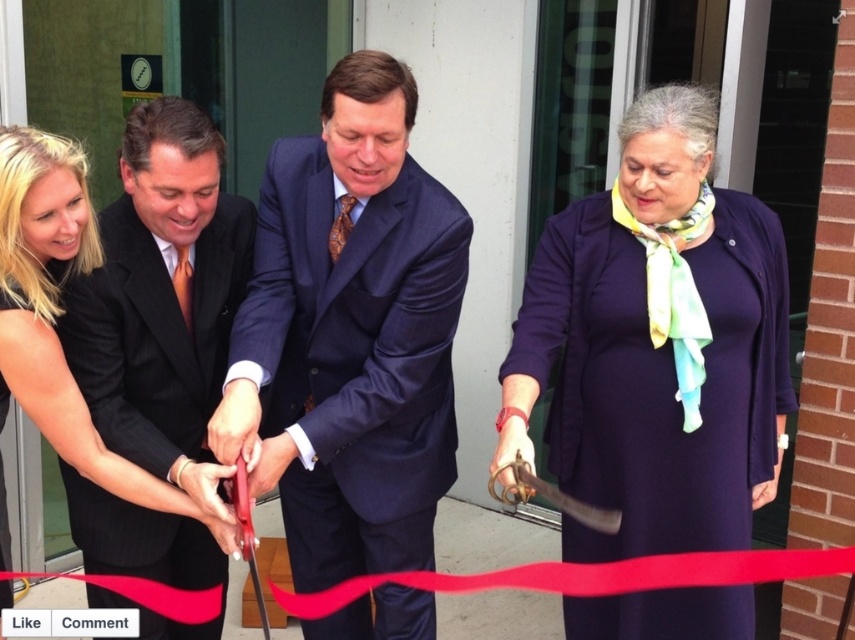
Is shiny blue suit at center bigger than black silk dress at center?

Indeed, shiny blue suit at center has a larger size compared to black silk dress at center.

Is shiny blue suit at center shorter than black silk dress at center?

No.

Find the location of a particular element. The height and width of the screenshot is (640, 855). shiny blue suit at center is located at coordinates (351, 333).

You are a GUI agent. You are given a task and a screenshot of the screen. Output one action in this format:
    pyautogui.click(x=<x>, y=<y>)
    Task: Click on the shiny blue suit at center
    The image size is (855, 640).
    Given the screenshot: What is the action you would take?
    pyautogui.click(x=351, y=333)

Does point (258, 284) come closer to viewer compared to point (647, 321)?

No, it is behind (647, 321).

Between shiny blue suit at center and yellow-green silk scarf at center, which one appears on the right side from the viewer's perspective?

Positioned to the right is yellow-green silk scarf at center.

Is point (345, 568) farther from camera compared to point (673, 296)?

Yes.

The image size is (855, 640). I want to click on shiny blue suit at center, so click(x=351, y=333).

Does black silk dress at center appear under yellow-green silk scarf at center?

Indeed, black silk dress at center is positioned under yellow-green silk scarf at center.

What do you see at coordinates (59, 314) in the screenshot? I see `black silk dress at center` at bounding box center [59, 314].

This screenshot has width=855, height=640. Find the location of `black silk dress at center`. black silk dress at center is located at coordinates click(59, 314).